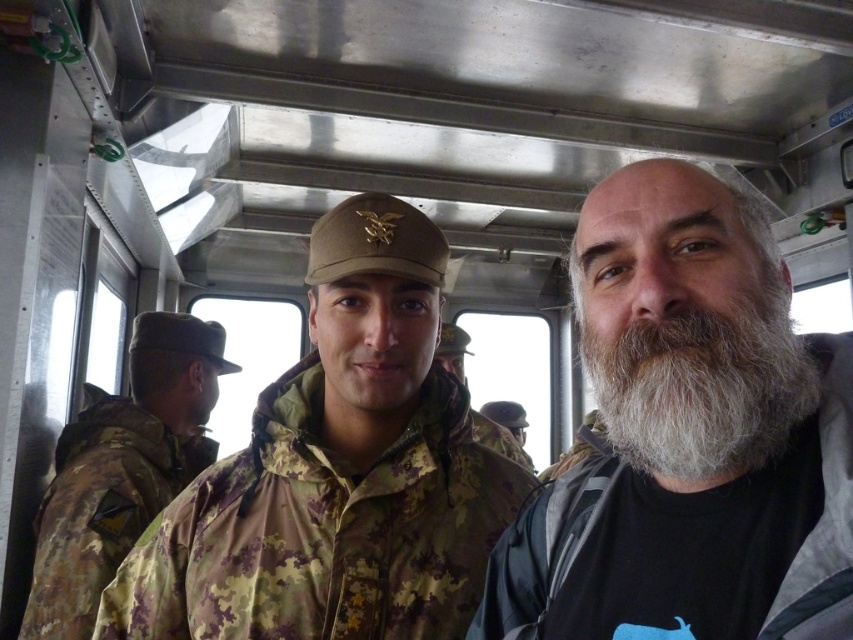
You are a photographer inside the military vehicle and want to take a clear photo of the white beard at center and the white fuzzy beard at center. Which one is closer to the camera?

The white beard at center is closer to the camera because it is positioned below the white fuzzy beard at center.

You are a photographer taking a picture of two people in a military vehicle. You notice the white beard at center and the white fuzzy beard at center. Which one is located to the right when viewed from the front?

The white beard at center is located to the right of the white fuzzy beard at center.

You are standing inside the military vehicle and want to determine which of the two points, point [489,442] or point [480,424], is closer to you. Based on the coordinates provided, which point is nearer?

Point [489,442] is closer to the camera than point [480,424], so it is the nearer point.